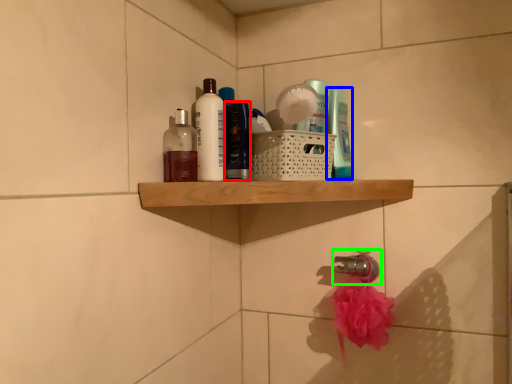
Question: Which object is the closest to the toiletry (highlighted by a red box)? Choose among these: toiletry (highlighted by a blue box) or tap (highlighted by a green box).

Choices:
 (A) toiletry
 (B) tap

Answer: (A)